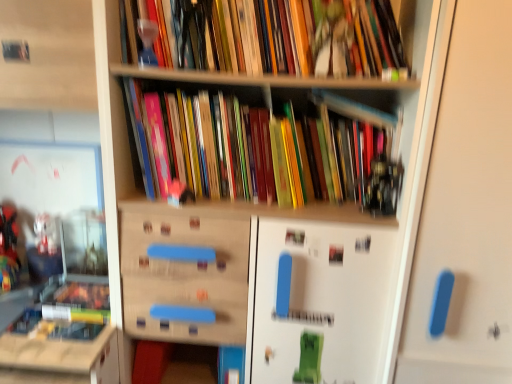
Question: From a real-world perspective, is hardcover books at upper center, which is the 2th book from bottom to top, positioned under wooden bookshelf at left based on gravity?

Choices:
 (A) no
 (B) yes

Answer: (A)

Question: Does hardcover books at upper center, which is the 2th book from bottom to top, have a greater width compared to wooden bookshelf at left?

Choices:
 (A) yes
 (B) no

Answer: (B)

Question: From the image's perspective, is hardcover books at upper center, which is the 2th book from bottom to top, beneath wooden bookshelf at left?

Choices:
 (A) yes
 (B) no

Answer: (B)

Question: Does hardcover books at upper center, which is the first book in top-to-bottom order, appear on the left side of wooden bookshelf at left?

Choices:
 (A) no
 (B) yes

Answer: (A)

Question: Could you tell me if hardcover books at upper center, which is the first book in top-to-bottom order, is facing wooden bookshelf at left?

Choices:
 (A) yes
 (B) no

Answer: (B)

Question: In the image, is hardcover books at upper center, which is the 2th book from bottom to top, positioned in front of or behind white matte door at right?

Choices:
 (A) behind
 (B) front

Answer: (A)

Question: Would you say hardcover books at upper center, which is the first book in top-to-bottom order, is inside or outside white matte door at right?

Choices:
 (A) outside
 (B) inside

Answer: (A)

Question: In terms of width, does hardcover books at upper center, which is the first book in top-to-bottom order, look wider or thinner when compared to white matte door at right?

Choices:
 (A) wide
 (B) thin

Answer: (B)

Question: From a real-world perspective, is hardcover books at upper center, which is the 2th book from bottom to top, positioned above or below white matte door at right?

Choices:
 (A) above
 (B) below

Answer: (A)

Question: Considering the relative positions of white matte door at right and translucent glass trophy at upper center in the image provided, is white matte door at right to the left or to the right of translucent glass trophy at upper center?

Choices:
 (A) right
 (B) left

Answer: (A)

Question: From a real-world perspective, is white matte door at right above or below translucent glass trophy at upper center?

Choices:
 (A) below
 (B) above

Answer: (A)

Question: From the image's perspective, relative to translucent glass trophy at upper center, is white matte door at right above or below?

Choices:
 (A) above
 (B) below

Answer: (B)

Question: Which is correct: white matte door at right is inside translucent glass trophy at upper center, or outside of it?

Choices:
 (A) inside
 (B) outside

Answer: (B)

Question: Considering the positions of wooden bookshelf at left and white matte door at right in the image, is wooden bookshelf at left taller or shorter than white matte door at right?

Choices:
 (A) short
 (B) tall

Answer: (B)

Question: In terms of width, does wooden bookshelf at left look wider or thinner when compared to white matte door at right?

Choices:
 (A) thin
 (B) wide

Answer: (B)